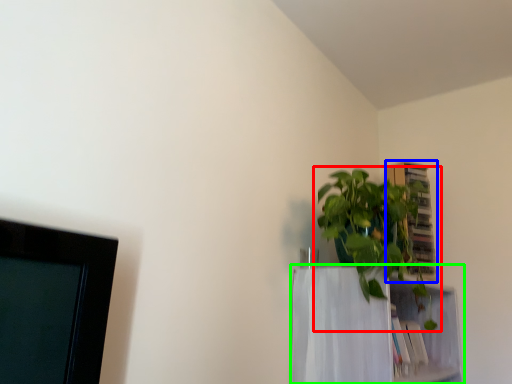
Question: Based on their relative distances, which object is nearer to houseplant (highlighted by a red box)? Choose from cabinet (highlighted by a blue box) and shelf (highlighted by a green box).

Choices:
 (A) cabinet
 (B) shelf

Answer: (B)